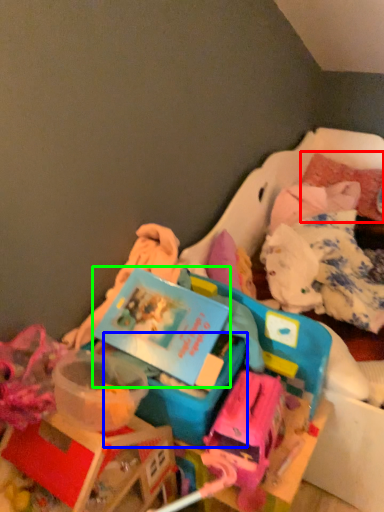
Question: Which object is positioned farthest from pillow (highlighted by a red box)? Select from storage box (highlighted by a blue box) and kit (highlighted by a green box).

Choices:
 (A) storage box
 (B) kit

Answer: (A)